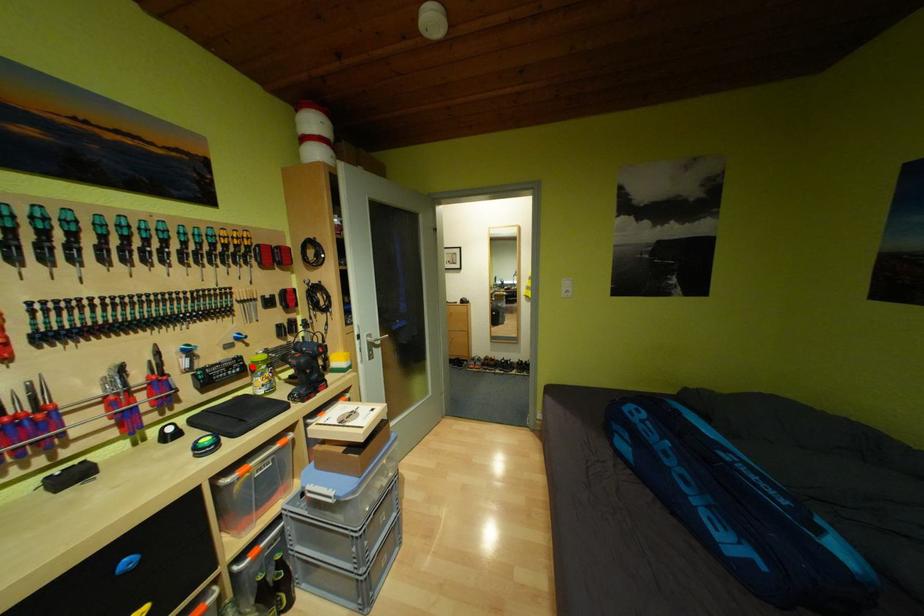
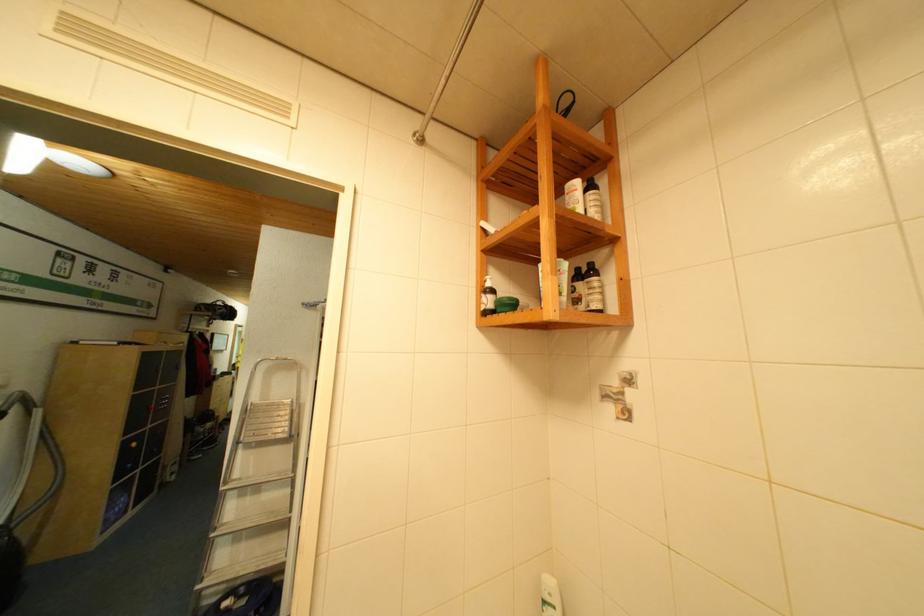
Question: I am providing you with two images of the same scene from different viewpoints. A red point is marked on the first image. At the location where the point appears in image 1, is it still visible in image 2?

Choices:
 (A) Yes
 (B) No

Answer: (B)